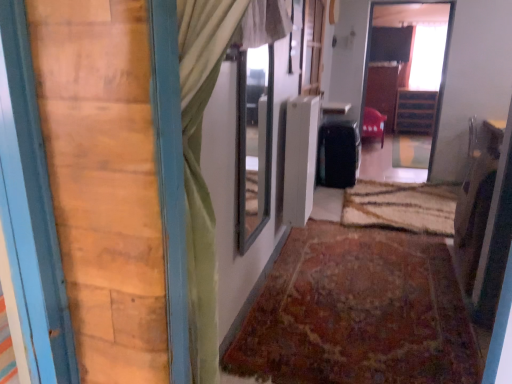
Question: Is wooden cabinet at center, the 1th furniture in the back-to-front sequence, next to clear glass window at center, marked as the second window in a right-to-left arrangement?

Choices:
 (A) no
 (B) yes

Answer: (A)

Question: Can you confirm if wooden cabinet at center, the 1th furniture in the back-to-front sequence, is thinner than clear glass window at center, the 1th window when ordered from left to right?

Choices:
 (A) no
 (B) yes

Answer: (A)

Question: Is clear glass window at center, which is counted as the 1th window, starting from the front, completely or partially inside wooden cabinet at center, acting as the second furniture starting from the front?

Choices:
 (A) yes
 (B) no

Answer: (B)

Question: Does wooden cabinet at center, marked as the 1th furniture in a right-to-left arrangement, appear on the right side of clear glass window at center, placed as the first window when sorted from bottom to top?

Choices:
 (A) no
 (B) yes

Answer: (B)

Question: Does wooden cabinet at center, acting as the second furniture starting from the front, have a smaller size compared to clear glass window at center, which is counted as the 1th window, starting from the front?

Choices:
 (A) no
 (B) yes

Answer: (A)

Question: From the image's perspective, is transparent glass window at upper right, the second window from the front, located above or below rug at center, marked as the 1th doormat in a front-to-back arrangement?

Choices:
 (A) above
 (B) below

Answer: (A)

Question: Based on their sizes in the image, would you say transparent glass window at upper right, placed as the first window when sorted from back to front, is bigger or smaller than rug at center, acting as the second doormat starting from the back?

Choices:
 (A) big
 (B) small

Answer: (A)

Question: Is transparent glass window at upper right, the second window from the front, in front of or behind rug at center, acting as the second doormat starting from the back, in the image?

Choices:
 (A) front
 (B) behind

Answer: (B)

Question: From their relative heights in the image, would you say transparent glass window at upper right, which ranks as the 1th window in right-to-left order, is taller or shorter than rug at center, acting as the second doormat starting from the back?

Choices:
 (A) tall
 (B) short

Answer: (A)

Question: From the image's perspective, is wooden barn door at left above or below wooden cabinet at center, acting as the second furniture starting from the front?

Choices:
 (A) below
 (B) above

Answer: (A)

Question: From a real-world perspective, is wooden barn door at left physically located above or below wooden cabinet at center, acting as the second furniture starting from the front?

Choices:
 (A) below
 (B) above

Answer: (B)

Question: Is wooden barn door at left bigger or smaller than wooden cabinet at center, the 1th furniture in the back-to-front sequence?

Choices:
 (A) big
 (B) small

Answer: (B)

Question: Visually, is wooden barn door at left positioned to the left or to the right of wooden cabinet at center, the 1th furniture in the back-to-front sequence?

Choices:
 (A) right
 (B) left

Answer: (B)

Question: Is matte red chair at center, acting as the 2th furniture starting from the right, bigger or smaller than wooden cabinet at center, acting as the second furniture starting from the front?

Choices:
 (A) small
 (B) big

Answer: (A)

Question: From a real-world perspective, is matte red chair at center, arranged as the first furniture when viewed from the front, positioned above or below wooden cabinet at center, the 1th furniture in the back-to-front sequence?

Choices:
 (A) above
 (B) below

Answer: (B)